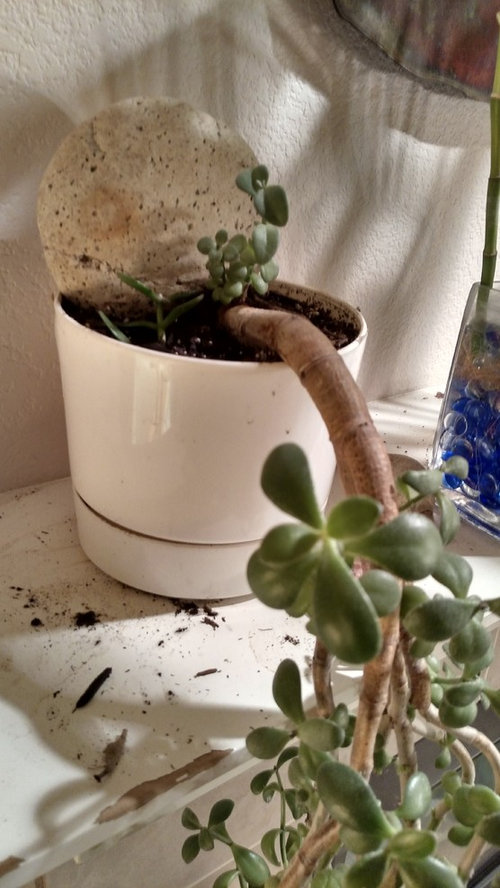
Locate an element on the screen. The image size is (500, 888). chipped paint is located at coordinates (149, 789).